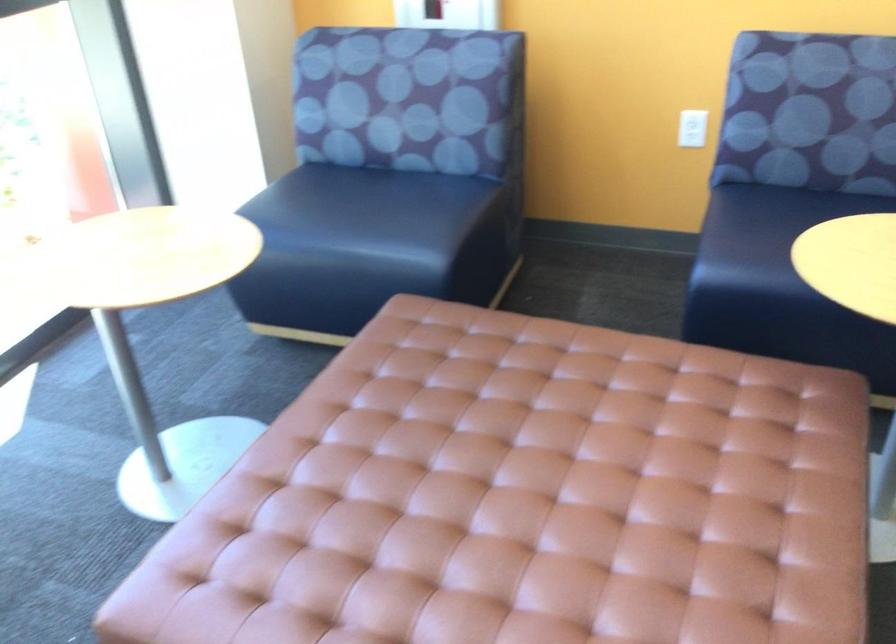
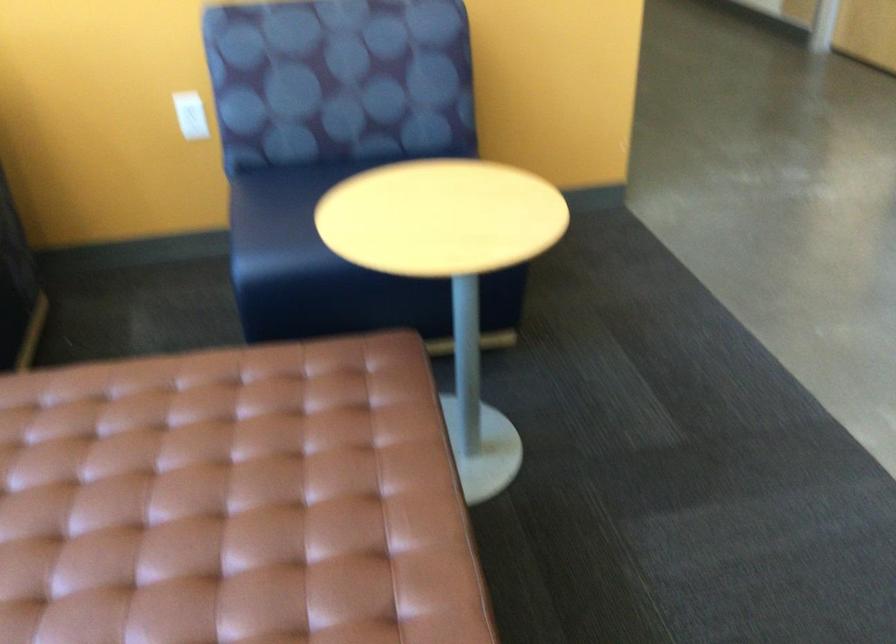
Find the pixel in the second image that matches point (695, 115) in the first image.

(188, 108)